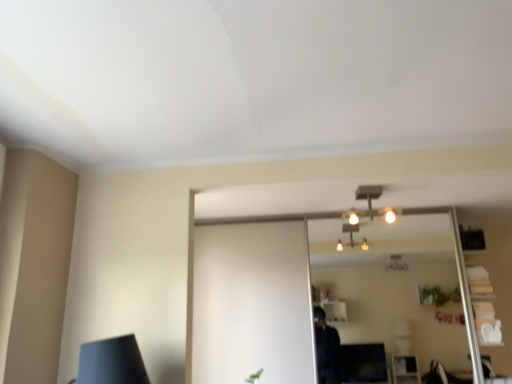
At what (x,y) coordinates should I click in order to perform the action: click on matte silver light fixture at center. Please return your answer as a coordinate pair (x, y). Looking at the image, I should click on (366, 212).

The image size is (512, 384). What do you see at coordinates (366, 212) in the screenshot?
I see `matte silver light fixture at center` at bounding box center [366, 212].

The image size is (512, 384). What do you see at coordinates (395, 284) in the screenshot? I see `clear glass mirror at center` at bounding box center [395, 284].

Measure the distance between clear glass mirror at center and camera.

They are 5.33 meters apart.

The width and height of the screenshot is (512, 384). I want to click on clear glass mirror at center, so click(395, 284).

The height and width of the screenshot is (384, 512). I want to click on matte silver light fixture at center, so click(366, 212).

Based on their positions, is clear glass mirror at center located to the left or right of matte silver light fixture at center?

From the image, it's evident that clear glass mirror at center is to the right of matte silver light fixture at center.

Is clear glass mirror at center in front of or behind matte silver light fixture at center in the image?

In the image, clear glass mirror at center appears behind matte silver light fixture at center.

Does point (407, 237) come farther from viewer compared to point (386, 212)?

That is True.

From the image's perspective, is clear glass mirror at center located above or below matte silver light fixture at center?

clear glass mirror at center is situated lower than matte silver light fixture at center in the image.

From a real-world perspective, is clear glass mirror at center on matte silver light fixture at center?

No, from a real-world perspective, clear glass mirror at center is not above matte silver light fixture at center.

Which of these two, clear glass mirror at center or matte silver light fixture at center, is thinner?

clear glass mirror at center is thinner.

Considering the sizes of clear glass mirror at center and matte silver light fixture at center in the image, is clear glass mirror at center taller or shorter than matte silver light fixture at center?

In the image, clear glass mirror at center appears to be taller than matte silver light fixture at center.

Consider the image. Which of these two, clear glass mirror at center or matte silver light fixture at center, is smaller?

With smaller size is matte silver light fixture at center.

Choose the correct answer: Is clear glass mirror at center inside matte silver light fixture at center or outside it?

clear glass mirror at center lies outside matte silver light fixture at center.

Is clear glass mirror at center with matte silver light fixture at center?

No, clear glass mirror at center is not next to matte silver light fixture at center.

Is clear glass mirror at center looking in the opposite direction of matte silver light fixture at center?

clear glass mirror at center is not turned away from matte silver light fixture at center.

You are a GUI agent. You are given a task and a screenshot of the screen. Output one action in this format:
    pyautogui.click(x=<x>, y=<y>)
    Task: Click on the fixture in front of the clear glass mirror at center
    The image size is (512, 384).
    Given the screenshot: What is the action you would take?
    [366, 212]

Based on the photo, between matte silver light fixture at center and clear glass mirror at center, which one appears on the right side from the viewer's perspective?

clear glass mirror at center.

Which object is further away from the camera taking this photo, matte silver light fixture at center or clear glass mirror at center?

clear glass mirror at center is further away from the camera.

Is point (398, 211) closer to viewer compared to point (383, 257)?

Yes, it is in front of point (383, 257).

From the image's perspective, between matte silver light fixture at center and clear glass mirror at center, which one is located above?

matte silver light fixture at center is shown above in the image.

From a real-world perspective, which is physically below, matte silver light fixture at center or clear glass mirror at center?

In real-world perspective, clear glass mirror at center is lower.

In terms of width, does matte silver light fixture at center look wider or thinner when compared to clear glass mirror at center?

matte silver light fixture at center is wider than clear glass mirror at center.

Considering the sizes of objects matte silver light fixture at center and clear glass mirror at center in the image provided, who is shorter, matte silver light fixture at center or clear glass mirror at center?

With less height is matte silver light fixture at center.

Does matte silver light fixture at center have a smaller size compared to clear glass mirror at center?

Correct, matte silver light fixture at center occupies less space than clear glass mirror at center.

Looking at this image, could clear glass mirror at center be considered to be inside matte silver light fixture at center?

No, matte silver light fixture at center does not contain clear glass mirror at center.

Does matte silver light fixture at center touch clear glass mirror at center?

matte silver light fixture at center and clear glass mirror at center are not in contact.

Is matte silver light fixture at center oriented away from clear glass mirror at center?

matte silver light fixture at center is not turned away from clear glass mirror at center.

What's the angular difference between matte silver light fixture at center and clear glass mirror at center's facing directions?

The angle between the facing direction of matte silver light fixture at center and the facing direction of clear glass mirror at center is 91.2 degrees.

In the scene shown: Measure the distance from matte silver light fixture at center to clear glass mirror at center.

9.04 feet.

This screenshot has width=512, height=384. In order to click on fixture on the left side of clear glass mirror at center in this screenshot , I will do `click(366, 212)`.

The height and width of the screenshot is (384, 512). I want to click on mirror to the right of matte silver light fixture at center, so click(x=395, y=284).

Locate an element on the screen. Image resolution: width=512 pixels, height=384 pixels. fixture that appears on the left of clear glass mirror at center is located at coordinates (366, 212).